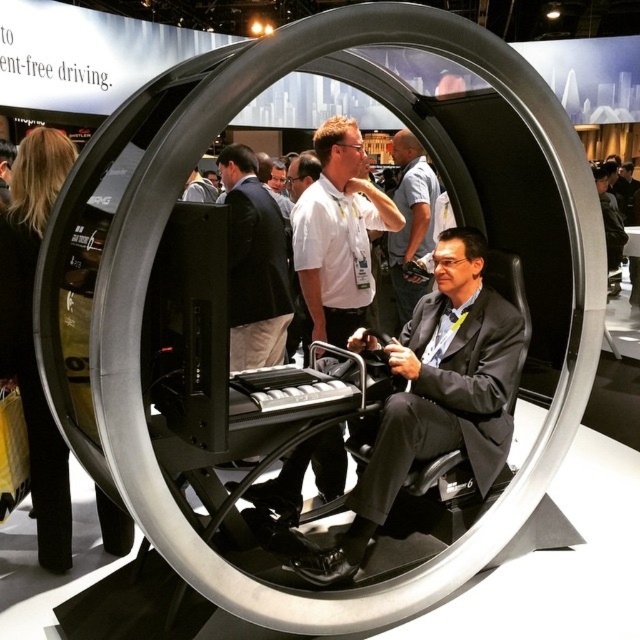
You are a security guard at the exhibition. You need to ensure that all visitors maintain a minimum distance of 1.5 meters between each other for safety. You notice two people wearing a white shirt at center and a light blue shirt at center. Are they violating the safety distance rule?

The white shirt at center and light blue shirt at center are 1.54 meters apart from each other, so they are just slightly over the required 1.5 meters distance. Therefore, they are not violating the safety distance rule.

You are standing at the entrance of the exhibition hall and want to locate the white glossy shirt at center. According to the coordinates provided, where should you look to find it?

The white glossy shirt at center is located at coordinates point (339,234), which would be in the central area slightly to the right from the entrance perspective.

You are a photographer at the exhibition and want to take a photo of the white glossy shirt at center and the matte black suit at center. Which one is positioned lower in the image?

The white glossy shirt at center is below the matte black suit at center, so it is positioned lower in the image.